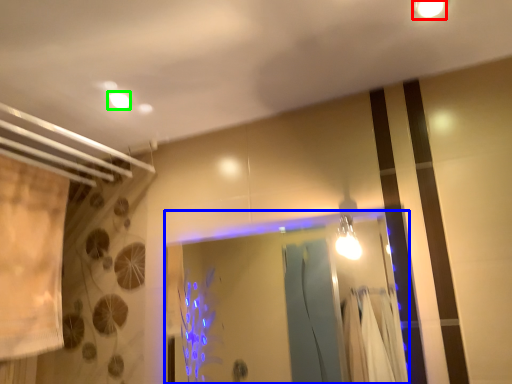
Question: Which is farther away from light fixture (highlighted by a red box)? glass door (highlighted by a blue box) or lighting (highlighted by a green box)?

Choices:
 (A) glass door
 (B) lighting

Answer: (A)